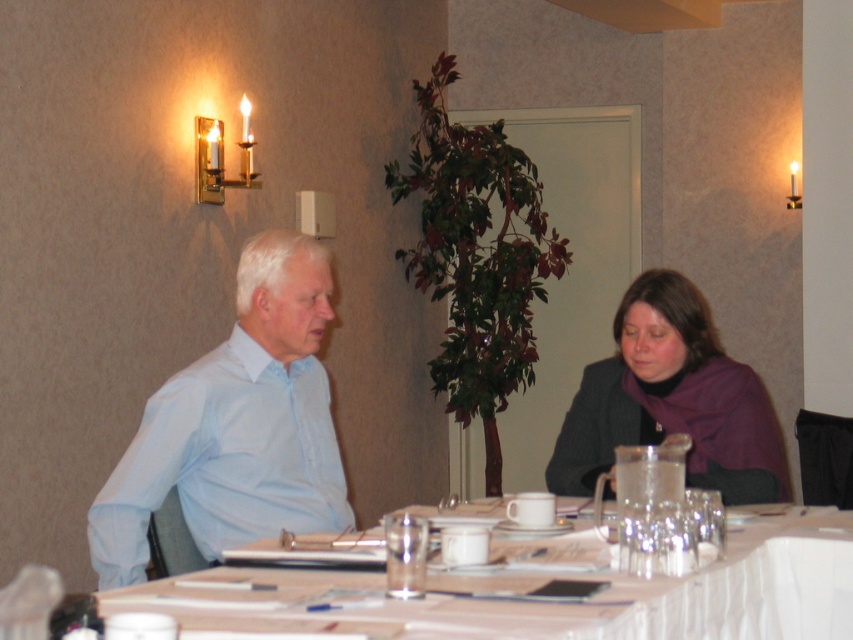
You are standing at the entrance of the conference room. You need to place a large presentation screen on the wall behind the white glossy table at center. Where should you position the screen so it is centered relative to the table?

The white glossy table at center is located at point (543, 602). To center the presentation screen behind it, position the screen so its center aligns with the same coordinates as the table.

You are organizing a meeting in this room and need to place a 1.2 meter wide banner across the table. Given the white glossy table at center and the light blue shirt at center, can the banner fit on the table?

The white glossy table at center is wider than the light blue shirt at center. Since the table is wider, the 1.2 meter banner should fit as long as the table itself is at least 1.2 meters wide. However, without knowing the exact width of the table, we can only confirm it is wider than the shirt, but not the shirt size. Therefore, it is uncertain if the banner will fit.